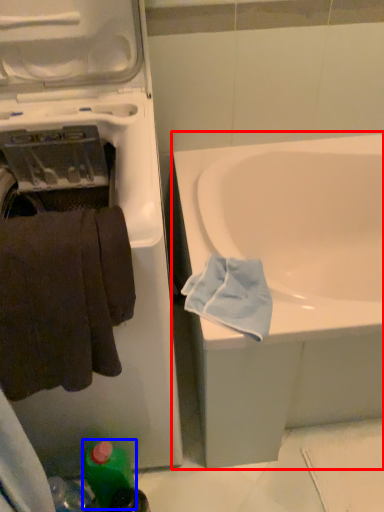
Question: Which of the following is the farthest to the observer, bathtub (highlighted by a red box) or bottle (highlighted by a blue box)?

Choices:
 (A) bathtub
 (B) bottle

Answer: (B)